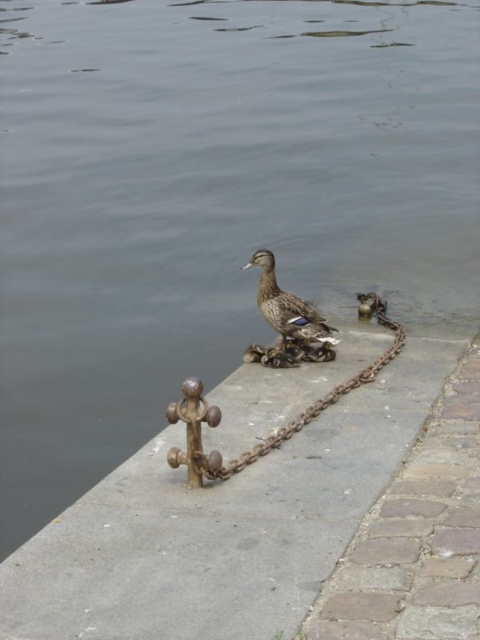
You are standing at the edge of the river and want to approach the duck on the smooth concrete pavement at center without getting your shoes wet. The path to the duck is along the concrete pavement. If your walking path is 3.5 meters long, will you reach the duck before the path ends?

The distance between you and the smooth concrete pavement at center is 4.04 meters. Since your path is only 3.5 meters long, you will not reach the duck before the path ends.